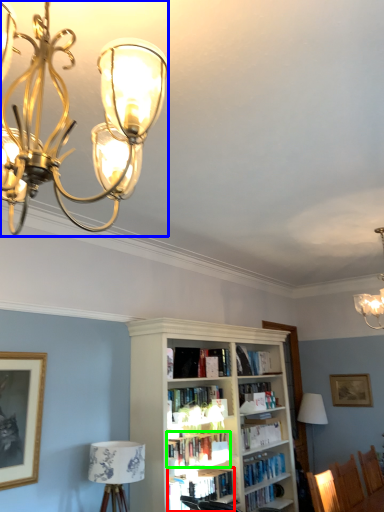
Question: Based on their relative distances, which object is nearer to book (highlighted by a red box)? Choose from lamp (highlighted by a blue box) and book (highlighted by a green box).

Choices:
 (A) lamp
 (B) book

Answer: (B)